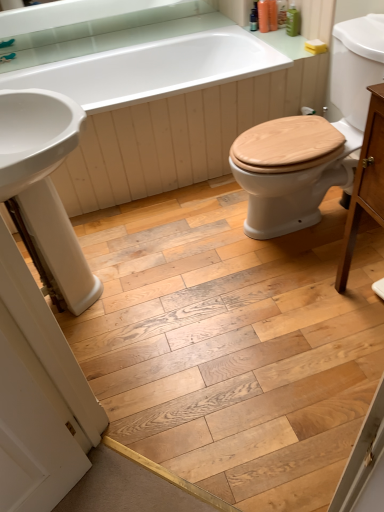
This screenshot has height=512, width=384. Find the location of `vacant space to the left of wooden at right`. vacant space to the left of wooden at right is located at coordinates (196, 238).